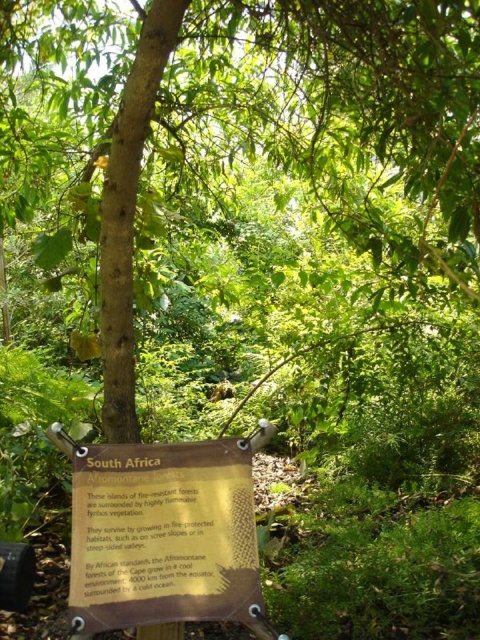
Question: Does brown rough bark tree at center appear on the right side of gold textured sign at center?

Choices:
 (A) no
 (B) yes

Answer: (B)

Question: Is brown rough bark tree at center to the left of gold textured sign at center from the viewer's perspective?

Choices:
 (A) no
 (B) yes

Answer: (A)

Question: Which of the following is the farthest from the observer?

Choices:
 (A) (176, 588)
 (B) (453, 42)

Answer: (B)

Question: Does brown rough bark tree at center have a greater width compared to gold textured sign at center?

Choices:
 (A) yes
 (B) no

Answer: (A)

Question: Which point is farther to the camera?

Choices:
 (A) gold textured sign at center
 (B) brown rough bark tree at center

Answer: (B)